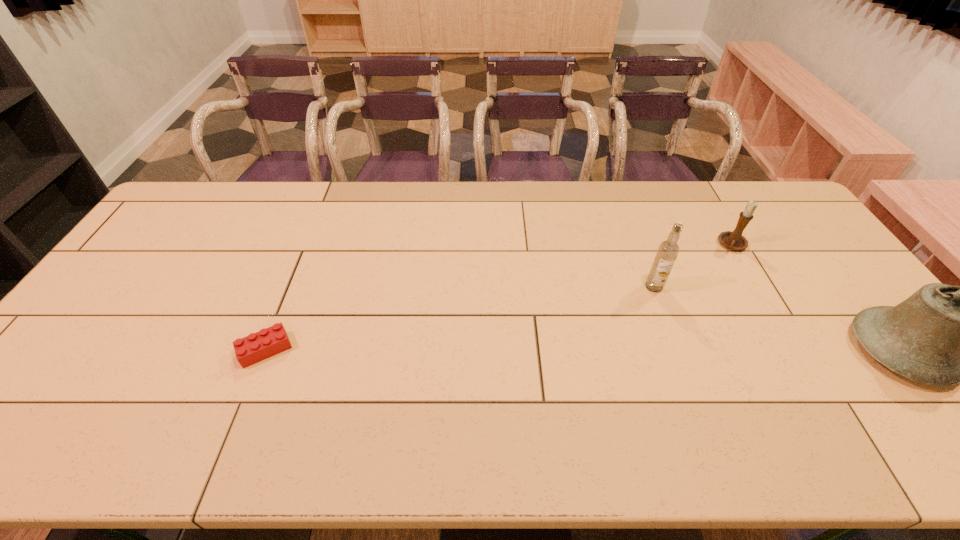
Image resolution: width=960 pixels, height=540 pixels. Identify the location of vacant space located 0.400m on the side of the farthest object with the handle. (668, 327).

Where is `blank space located on the side of the farthest object with the handle`? The image size is (960, 540). blank space located on the side of the farthest object with the handle is located at coordinates pos(708,276).

This screenshot has height=540, width=960. Find the location of `vacant point located on the side of the farthest object with the handle`. vacant point located on the side of the farthest object with the handle is located at coordinates (700, 287).

You are a GUI agent. You are given a task and a screenshot of the screen. Output one action in this format:
    pyautogui.click(x=<x>, y=<y>)
    Task: Click on the vacant space at the far edge of the desktop
    The height and width of the screenshot is (540, 960).
    Given the screenshot: What is the action you would take?
    pyautogui.click(x=274, y=216)

In the image, there is a desktop. At what (x,y) coordinates should I click in order to perform the action: click on vacant space at the near edge. Please return your answer as a coordinate pair (x, y). Looking at the image, I should click on pos(432,394).

This screenshot has height=540, width=960. Find the location of `vacant space at the left edge of the desktop`. vacant space at the left edge of the desktop is located at coordinates (204, 227).

This screenshot has height=540, width=960. In the image, there is a desktop. Identify the location of vacant space at the right edge. (807, 274).

Where is `vacant space at the far right corner of the desktop`? vacant space at the far right corner of the desktop is located at coordinates click(769, 221).

Image resolution: width=960 pixels, height=540 pixels. Identify the location of free space that is in between the shortest object and the farthest object. (499, 297).

Where is `free space between the farthest object and the leftmost object`? The height and width of the screenshot is (540, 960). free space between the farthest object and the leftmost object is located at coordinates click(x=499, y=297).